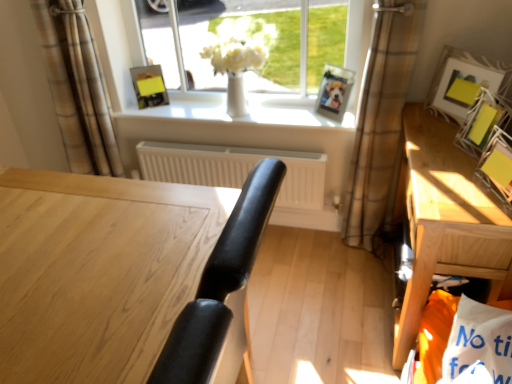
I want to click on free space below brown plaid curtain at center right, which is the first curtain from right to left (from a real-world perspective), so click(352, 250).